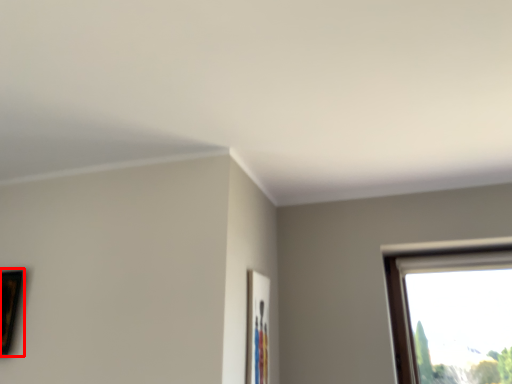
Question: From the image's perspective, where is picture frame (annotated by the red box) located relative to picture frame?

Choices:
 (A) below
 (B) above

Answer: (B)